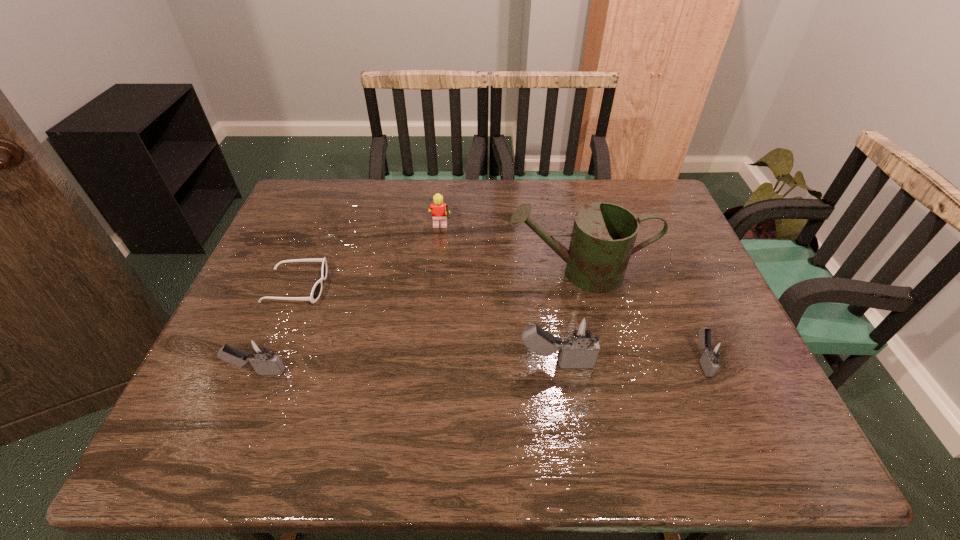
Where is `object that stands as the second closest to the farthest object`? Image resolution: width=960 pixels, height=540 pixels. object that stands as the second closest to the farthest object is located at coordinates [x=316, y=291].

You are a GUI agent. You are given a task and a screenshot of the screen. Output one action in this format:
    pyautogui.click(x=<x>, y=<y>)
    Task: Click on the object that ranks as the closest to the tallest object
    Image resolution: width=960 pixels, height=540 pixels.
    Given the screenshot: What is the action you would take?
    (x=714, y=350)

Select which igniter is the closest to the shortest igniter. Please provide its 2D coordinates. Your answer should be formatted as a tuple, i.e. [(x, y)], where the tuple contains the x and y coordinates of a point satisfying the conditions above.

[(578, 348)]

Identify the location of the closest igniter to the shortest igniter. (578, 348).

I want to click on free point that satisfies the following two spatial constraints: 1. with the lenses of the sunglasses facing outward; 2. on the back side of the rightmost igniter, so click(267, 360).

Identify the location of free location that satisfies the following two spatial constraints: 1. with the lenses of the fifth shortest object facing outward; 2. on the left side of the shortest object. (265, 363).

The height and width of the screenshot is (540, 960). Find the location of `vacant point that satisfies the following two spatial constraints: 1. in front of the Lego with the accessory visible; 2. on the front side of the leftmost igniter`. vacant point that satisfies the following two spatial constraints: 1. in front of the Lego with the accessory visible; 2. on the front side of the leftmost igniter is located at coordinates (426, 372).

Locate an element on the screen. free location that satisfies the following two spatial constraints: 1. with the spout on the shortest igniter; 2. on the right side of the watering can is located at coordinates (598, 360).

You are a GUI agent. You are given a task and a screenshot of the screen. Output one action in this format:
    pyautogui.click(x=<x>, y=<y>)
    Task: Click on the vacant region that satisfies the following two spatial constraints: 1. in front of the Lego with the accessory visible; 2. on the right side of the shortest igniter
    This screenshot has height=540, width=960.
    Given the screenshot: What is the action you would take?
    pyautogui.click(x=427, y=360)

Image resolution: width=960 pixels, height=540 pixels. I want to click on free space that satisfies the following two spatial constraints: 1. on the back side of the shortest igniter; 2. on the left side of the tallest igniter, so click(x=556, y=360).